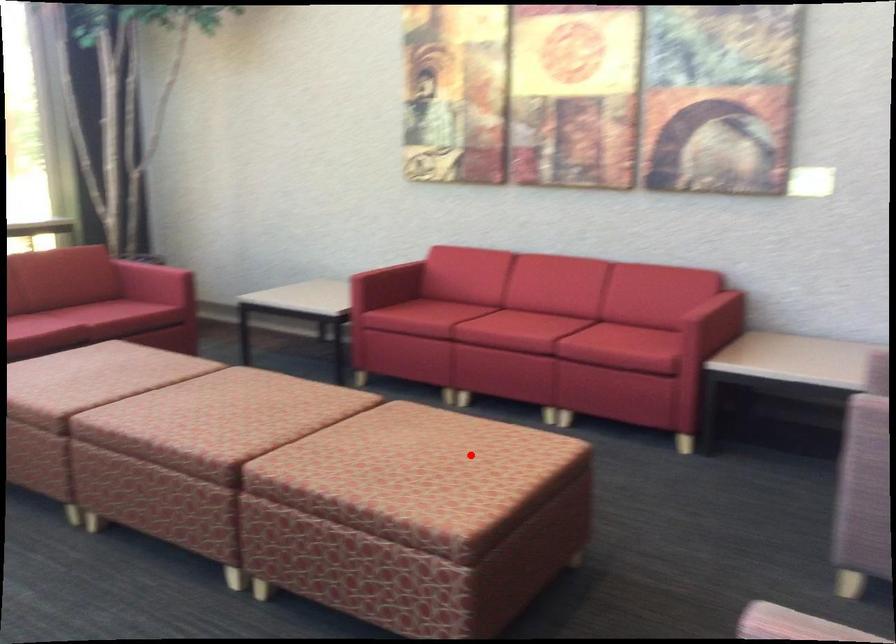
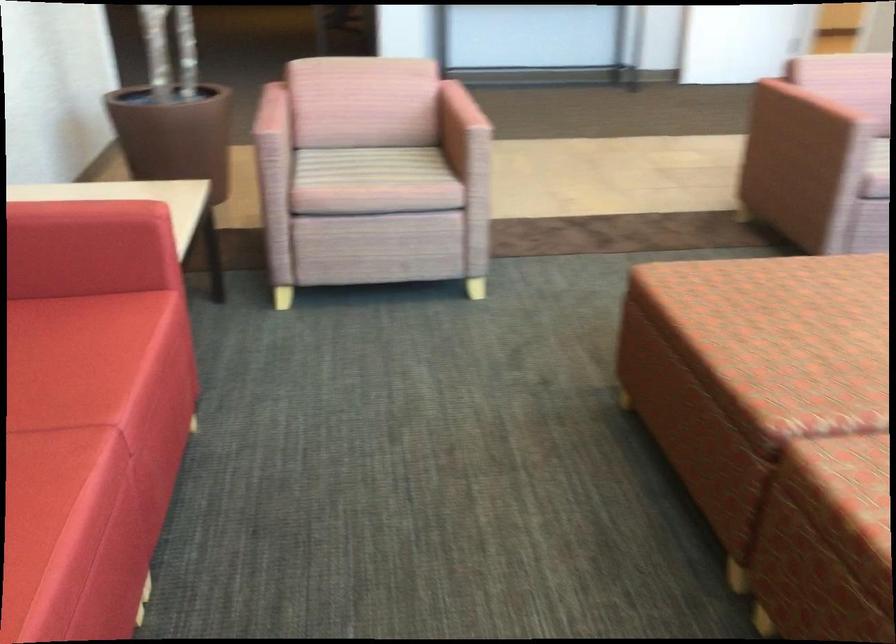
Question: I am providing you with two images of the same scene from different viewpoints. A red point is marked on the first image. Is the red point's position out of view in image 2?

Choices:
 (A) Yes
 (B) No

Answer: (B)